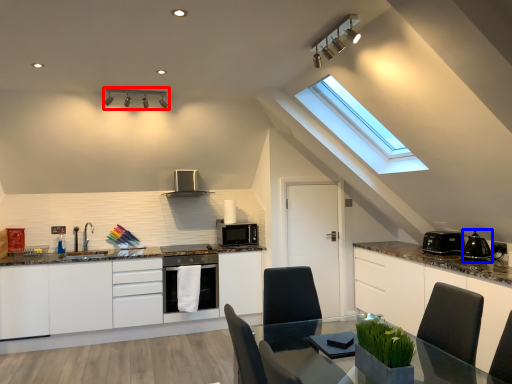
Question: Which of the following is the farthest to the observer, light fixture (highlighted by a red box) or appliance (highlighted by a blue box)?

Choices:
 (A) light fixture
 (B) appliance

Answer: (A)